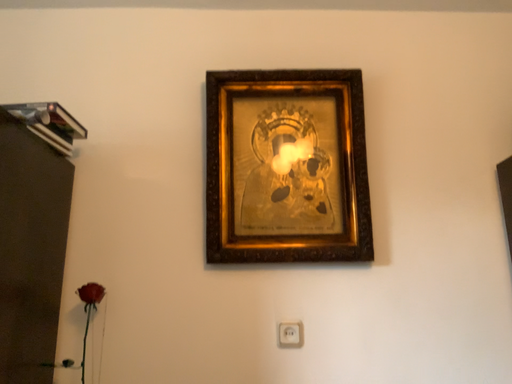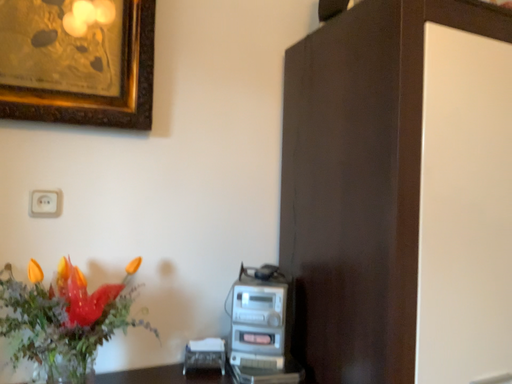
Question: How did the camera likely rotate when shooting the video?

Choices:
 (A) rotated right
 (B) rotated left

Answer: (A)